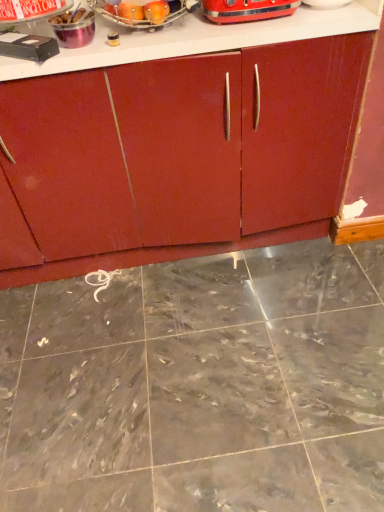
Identify the location of vacant area to the right of metallic silver container at upper left, the third appliance positioned from the left. (130, 41).